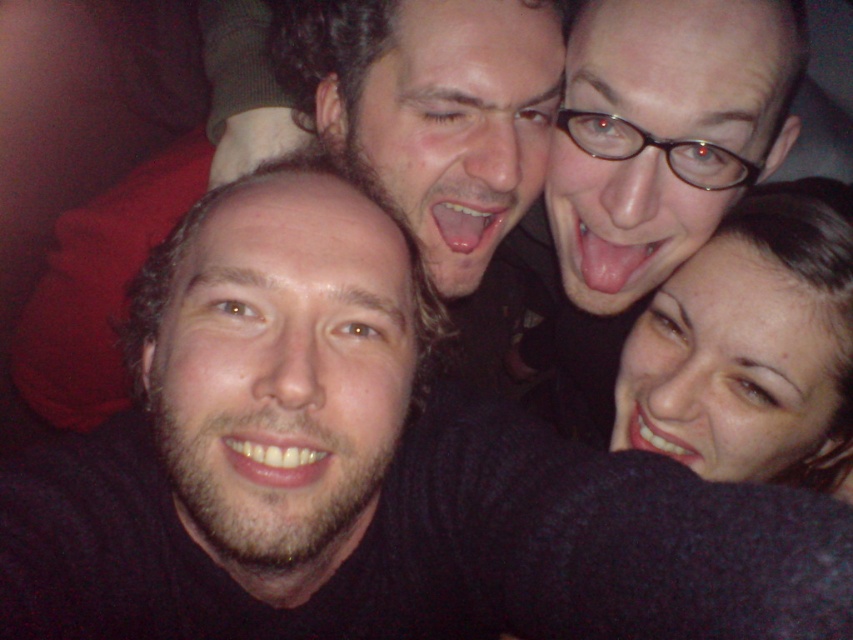
Can you confirm if smooth skin mouth at center is taller than pink flesh at center?

In fact, smooth skin mouth at center may be shorter than pink flesh at center.

This screenshot has width=853, height=640. What do you see at coordinates (276, 460) in the screenshot?
I see `smooth skin mouth at center` at bounding box center [276, 460].

Is point (316, 456) farther from camera compared to point (621, 275)?

No, it is in front of (621, 275).

Where is `smooth skin mouth at center`? The width and height of the screenshot is (853, 640). smooth skin mouth at center is located at coordinates (276, 460).

Which is more to the right, glossy white teeth at center or white glossy teeth at lower right?

white glossy teeth at lower right

Which is above, glossy white teeth at center or white glossy teeth at lower right?

glossy white teeth at center is higher up.

Who is more distant from viewer, (490, 214) or (666, 444)?

Positioned behind is point (666, 444).

I want to click on glossy white teeth at center, so click(x=467, y=218).

Between smooth skin face at lower right and glossy white teeth at center, which one appears on the right side from the viewer's perspective?

smooth skin face at lower right

Can you confirm if smooth skin face at lower right is thinner than glossy white teeth at center?

Incorrect, smooth skin face at lower right's width is not less than glossy white teeth at center's.

Is point (714, 472) less distant than point (476, 218)?

No, (714, 472) is behind (476, 218).

Find the location of `smooth skin face at lower right`. smooth skin face at lower right is located at coordinates coord(749,349).